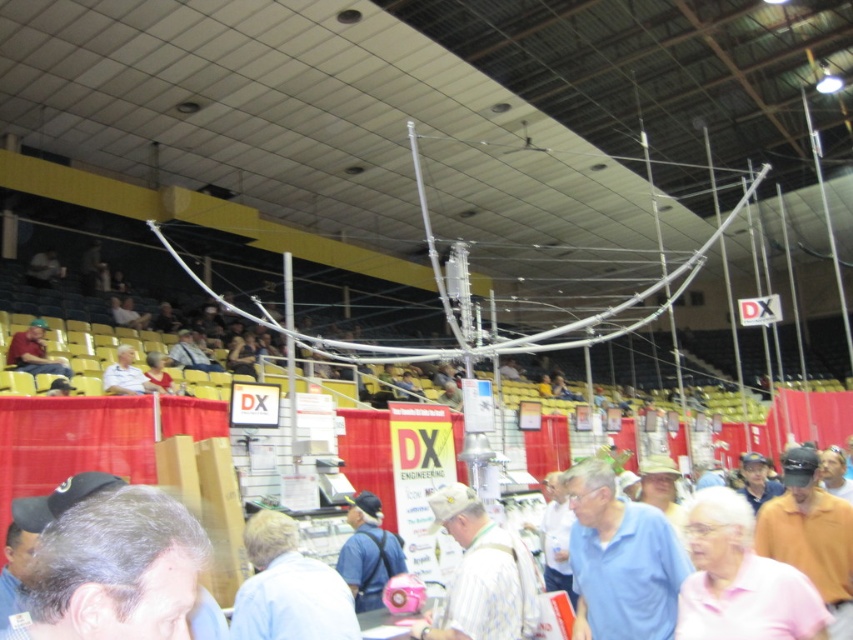
You are standing in the convention hall and want to take a photo of both the point at coordinates (517, 600) and the point at coordinates (16, 356). Which point should you focus on first to ensure both are in sharp focus?

You should focus on the point at coordinates (517, 600) first because it is closer to the camera than the point at coordinates (16, 356). This ensures that both points will be in focus when using the camera.

You are organizing a photo shoot in the event space and need to place two shirts on a mannequin. The blue cotton shirt at center and the light blue shirt at center are available. Which shirt should you choose if you want the one that is larger?

The blue cotton shirt at center is bigger than the light blue shirt at center, so you should choose the blue cotton shirt at center for the larger size.